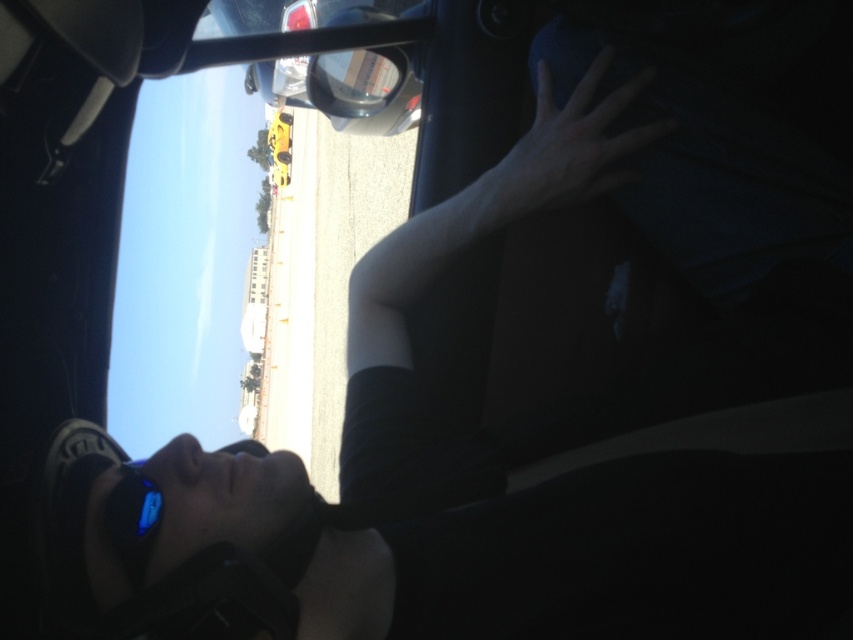
Question: Among these objects, which one is farthest from the camera?

Choices:
 (A) sunglasses at lower left
 (B) skinny white hand at upper center

Answer: (B)

Question: Is skinny white hand at upper center to the left of sunglasses at lower left from the viewer's perspective?

Choices:
 (A) no
 (B) yes

Answer: (A)

Question: Is skinny white hand at upper center above sunglasses at lower left?

Choices:
 (A) yes
 (B) no

Answer: (A)

Question: Observing the image, what is the correct spatial positioning of skinny white hand at upper center in reference to sunglasses at lower left?

Choices:
 (A) left
 (B) right

Answer: (B)

Question: Which object is closer to the camera taking this photo?

Choices:
 (A) sunglasses at lower left
 (B) skinny white hand at upper center

Answer: (A)